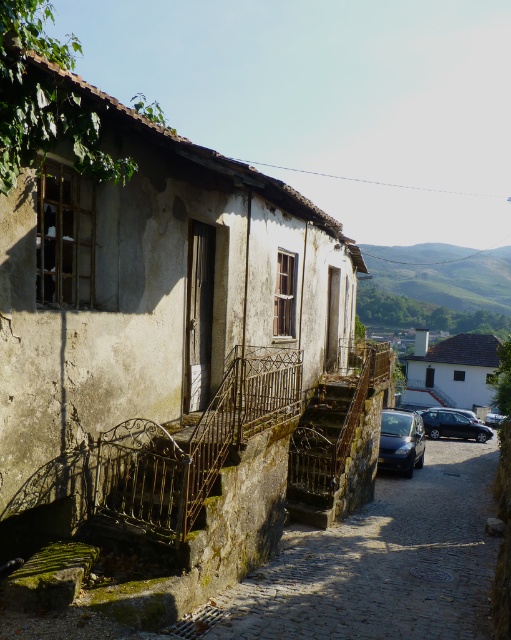
You are standing at the base of the cobblestone street in front of the weathered stone building. You need to reach the entrance of the building. Which object, the rusty metal stairs at lower left or the satin black car at lower right, is closer to the entrance?

The rusty metal stairs at lower left are closer to the entrance because they are taller than the satin black car at lower right, meaning they are positioned higher up the slope towards the building.

You are a delivery person trying to park your satin black car at lower right near the building. However, there are rusty metal stairs at lower left in the way. Can you park your car to the right of the stairs without overlapping them?

Yes, the rusty metal stairs at lower left is to the left of satin black car at lower right, so parking the satin black car at lower right to the right of the stairs is possible without overlapping them.